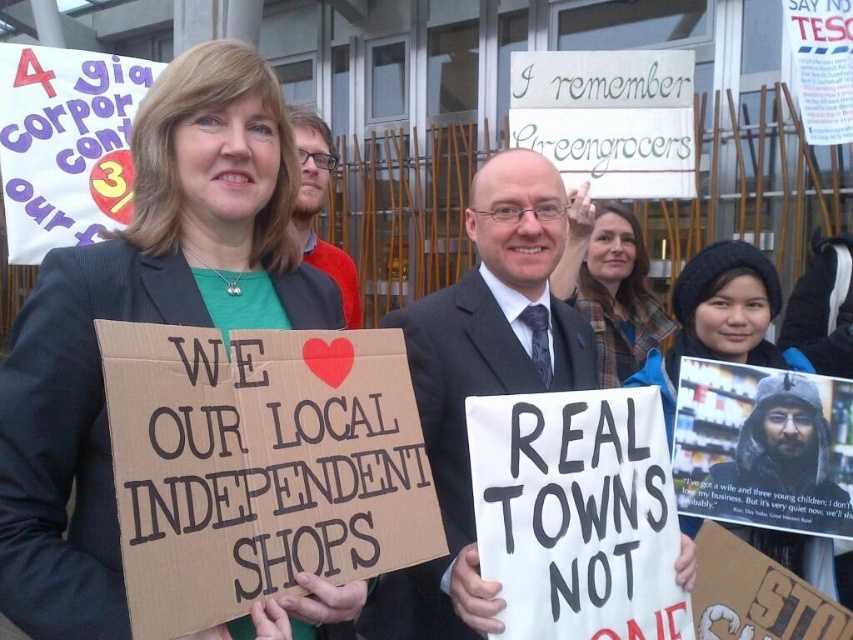
Based on the scene description, which object is closer to the viewer? The dark gray suit at center or the blue knit hat at upper right?

The dark gray suit at center is closer to the viewer because it is in front of the blue knit hat at upper right.

You are a photographer at the protest scene. You need to take a photo that includes both the dark gray suit at center and the blue knit hat at upper right. Based on their positions, which object should be placed on the left side of the photo frame?

The dark gray suit at center should be placed on the left side of the photo frame since it is positioned to the left of the blue knit hat at upper right in the scene.